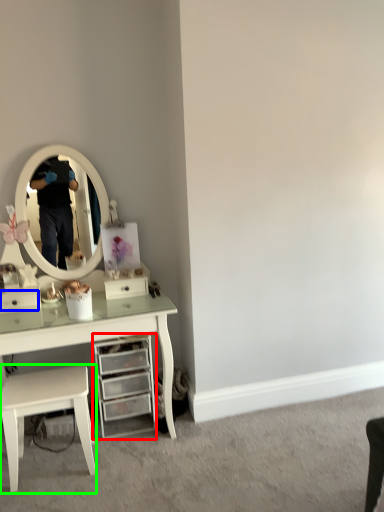
Question: Which object is positioned farthest from chest of drawers (highlighted by a red box)? Select from drawer (highlighted by a blue box) and stool (highlighted by a green box).

Choices:
 (A) drawer
 (B) stool

Answer: (A)